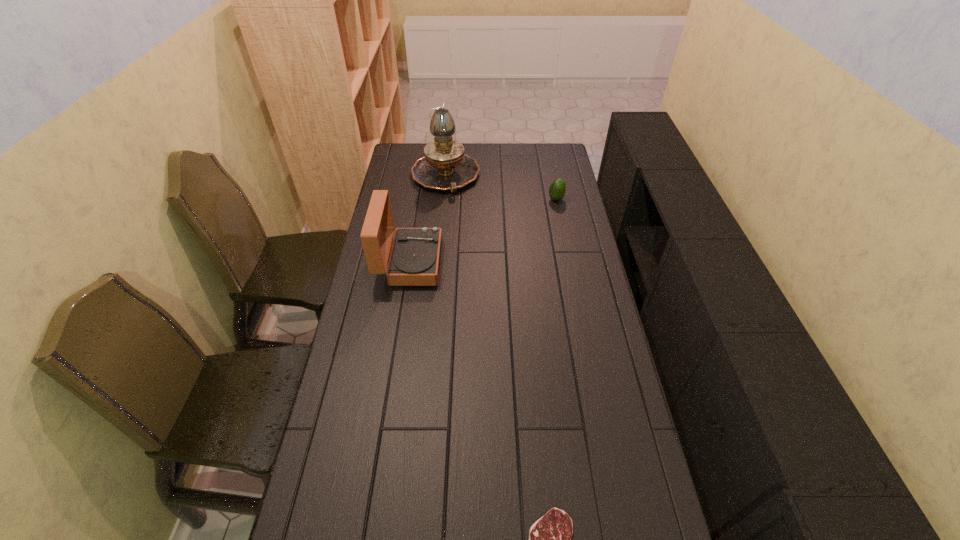
At what (x,y) coordinates should I click in order to perform the action: click on free space between the oil lamp and the second tallest object. Please return your answer as a coordinate pair (x, y). This screenshot has width=960, height=540. Looking at the image, I should click on [427, 219].

This screenshot has height=540, width=960. In order to click on the third closest object to the second object from right to left in this screenshot , I will do `click(444, 166)`.

Choose which object is the third nearest neighbor to the nearest object. Please provide its 2D coordinates. Your answer should be formatted as a tuple, i.e. [(x, y)], where the tuple contains the x and y coordinates of a point satisfying the conditions above.

[(444, 166)]

I want to click on free spot that satisfies the following two spatial constraints: 1. on the front side of the avocado; 2. on the face of the phonograph record, so click(x=568, y=262).